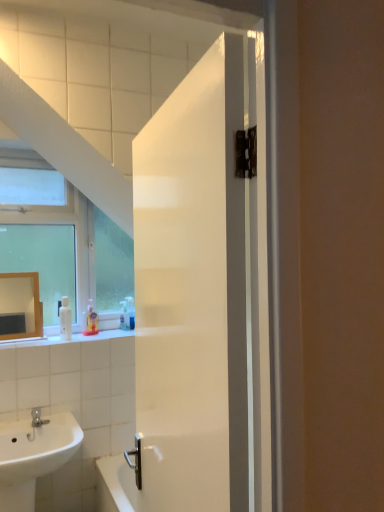
Question: Should I look upward or downward to see translucent plastic soap dispenser at lower left, the 2th toiletry when ordered from back to front?

Choices:
 (A) down
 (B) up

Answer: (A)

Question: From a real-world perspective, is matte gold mirror at upper left located beneath translucent plastic soap at lower left, which is counted as the 2th toiletry, starting from the front?

Choices:
 (A) no
 (B) yes

Answer: (A)

Question: Can you confirm if matte gold mirror at upper left is positioned to the left of translucent plastic soap at lower left, which is counted as the 2th toiletry, starting from the front?

Choices:
 (A) yes
 (B) no

Answer: (A)

Question: Is matte gold mirror at upper left next to translucent plastic soap at lower left, which is the first toiletry from right to left?

Choices:
 (A) no
 (B) yes

Answer: (A)

Question: From a real-world perspective, does matte gold mirror at upper left stand above translucent plastic soap at lower left, which is the first toiletry from right to left?

Choices:
 (A) yes
 (B) no

Answer: (A)

Question: Is matte gold mirror at upper left oriented away from translucent plastic soap at lower left, which is the 1th toiletry from back to front?

Choices:
 (A) yes
 (B) no

Answer: (B)

Question: Does matte gold mirror at upper left have a lesser width compared to translucent plastic soap at lower left, which is the 1th toiletry from back to front?

Choices:
 (A) yes
 (B) no

Answer: (B)

Question: Does translucent plastic soap at lower left, placed as the 2th toiletry when sorted from left to right, come behind matte gold mirror at upper left?

Choices:
 (A) yes
 (B) no

Answer: (A)

Question: From the image's perspective, is translucent plastic soap at lower left, which is the first toiletry from right to left, on top of matte gold mirror at upper left?

Choices:
 (A) yes
 (B) no

Answer: (B)

Question: Considering the relative positions of translucent plastic soap at lower left, which is the first toiletry from right to left, and matte gold mirror at upper left in the image provided, is translucent plastic soap at lower left, which is the first toiletry from right to left, to the left of matte gold mirror at upper left from the viewer's perspective?

Choices:
 (A) no
 (B) yes

Answer: (A)

Question: Considering the relative sizes of translucent plastic soap at lower left, which is the first toiletry from right to left, and matte gold mirror at upper left in the image provided, is translucent plastic soap at lower left, which is the first toiletry from right to left, wider than matte gold mirror at upper left?

Choices:
 (A) no
 (B) yes

Answer: (A)

Question: Are translucent plastic soap at lower left, placed as the 2th toiletry when sorted from left to right, and matte gold mirror at upper left making contact?

Choices:
 (A) no
 (B) yes

Answer: (A)

Question: Does translucent plastic soap at lower left, which is the 1th toiletry from back to front, have a lesser height compared to matte gold mirror at upper left?

Choices:
 (A) yes
 (B) no

Answer: (A)

Question: Is white glossy sink at lower left behind white glossy soap dispenser at left?

Choices:
 (A) yes
 (B) no

Answer: (B)